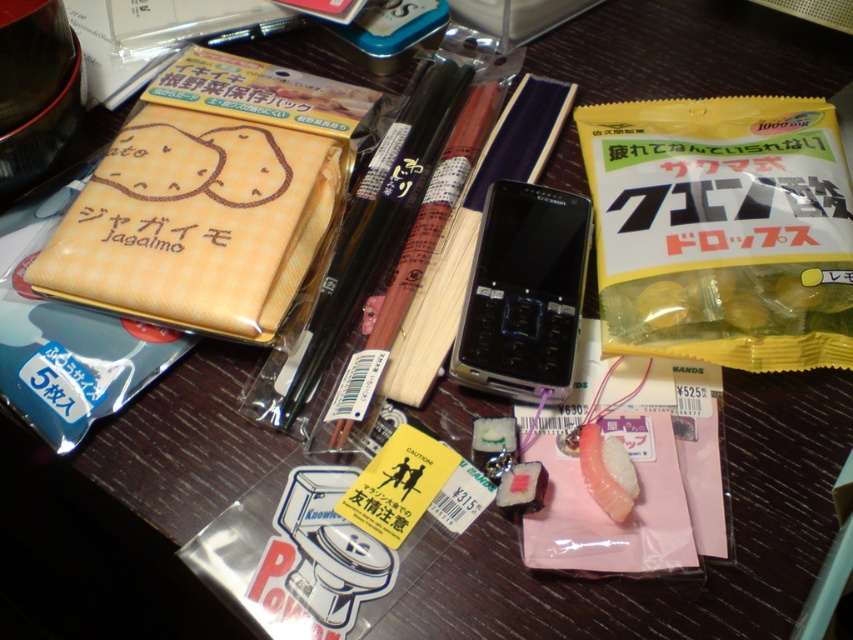
You are organizing the items on the desk and need to place a new item between the black plastic pen at center and the yellow gelatinous candies at center right. Where should you place it to ensure it fits between them?

Since the black plastic pen at center is in front of the yellow gelatinous candies at center right, you should place the new item behind the black plastic pen at center and in front of the yellow gelatinous candies at center right to fit between them.

You are organizing the items on the table. Which object is located at the coordinates point (195, 224)?

The point (195, 224) corresponds to the yellow fabric pouch at upper left.